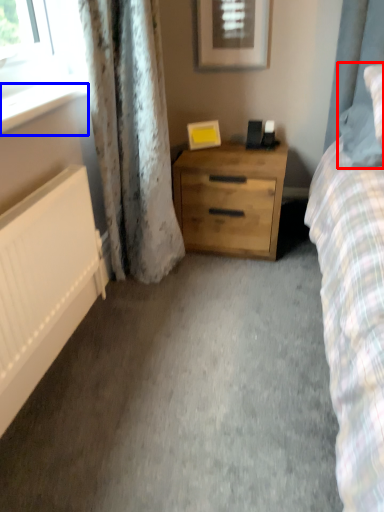
Question: Among these objects, which one is farthest to the camera, pillow (highlighted by a red box) or window sill (highlighted by a blue box)?

Choices:
 (A) pillow
 (B) window sill

Answer: (A)